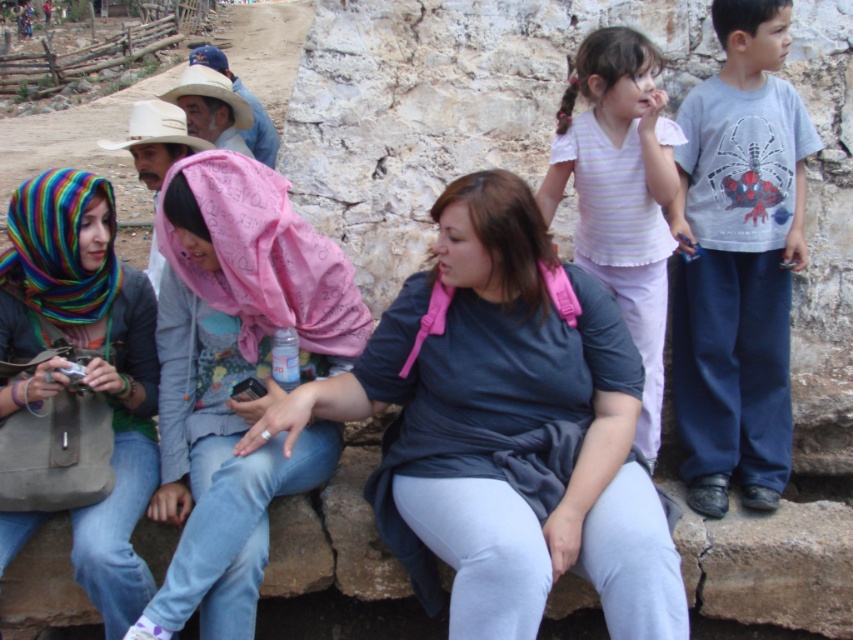
You are a photographer setting up a shot and need to ensure that the pink fabric headscarf at center and the striped cotton shirt at upper right are both visible in your frame. Given their sizes, which object will occupy more space in the photo?

The pink fabric headscarf at center will occupy more space in the photo since its width is larger than that of the striped cotton shirt at upper right.

You are a photographer trying to capture a group photo of the people on the stone steps. The camera you are using has a maximum focus range of 6 feet. Can you ensure that both the pink fabric headscarf at center and the striped cotton shirt at upper right are in focus at the same time?

The distance between the pink fabric headscarf at center and the striped cotton shirt at upper right is 6.10 feet, which exceeds the camera maximum focus range of 6 feet. Therefore, both cannot be in focus simultaneously.